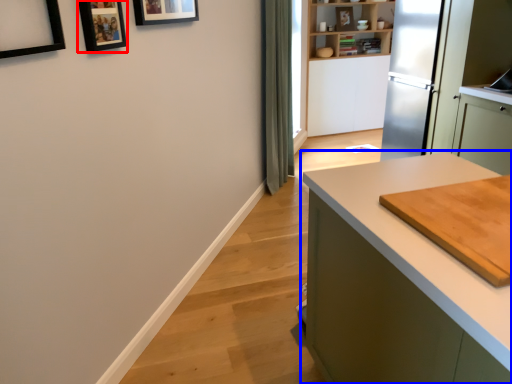
Question: Which of the following is the farthest to the observer, picture frame (highlighted by a red box) or countertop (highlighted by a blue box)?

Choices:
 (A) picture frame
 (B) countertop

Answer: (A)